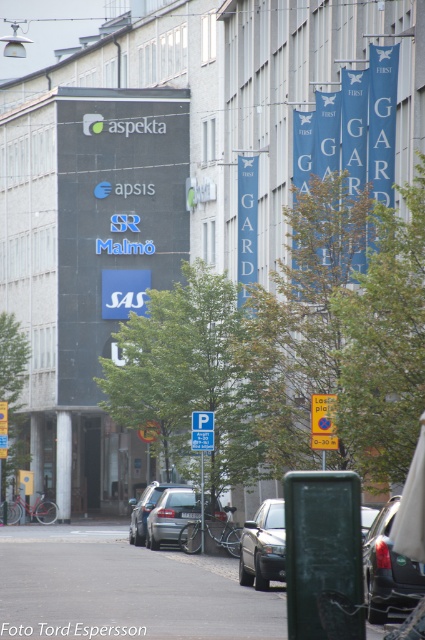
Question: Does matte black signboard at center have a smaller size compared to satin black sedan at center?

Choices:
 (A) no
 (B) yes

Answer: (A)

Question: Is the position of shiny black car at lower right more distant than that of white plastic parking sign at center?

Choices:
 (A) yes
 (B) no

Answer: (B)

Question: Estimate the real-world distances between objects in this image. Which object is closer to the satin black sedan at center?

Choices:
 (A) matte black signboard at center
 (B) silver metallic sedan at center
 (C) matte black car at center

Answer: (C)

Question: Which point is farther from the camera taking this photo?

Choices:
 (A) click(x=377, y=579)
 (B) click(x=79, y=332)
 (C) click(x=248, y=536)

Answer: (B)

Question: Which point is farther to the camera?

Choices:
 (A) shiny black car at lower right
 (B) white plastic parking sign at center
 (C) satin black sedan at center
 (D) silver metallic sedan at center

Answer: (D)

Question: Is shiny black car at lower right in front of satin black sedan at center?

Choices:
 (A) yes
 (B) no

Answer: (A)